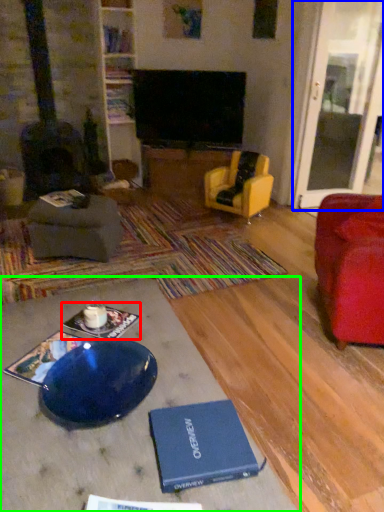
Question: Estimate the real-world distances between objects in this image. Which object is farther from book (highlighted by a red box), glass door (highlighted by a blue box) or table (highlighted by a green box)?

Choices:
 (A) glass door
 (B) table

Answer: (A)